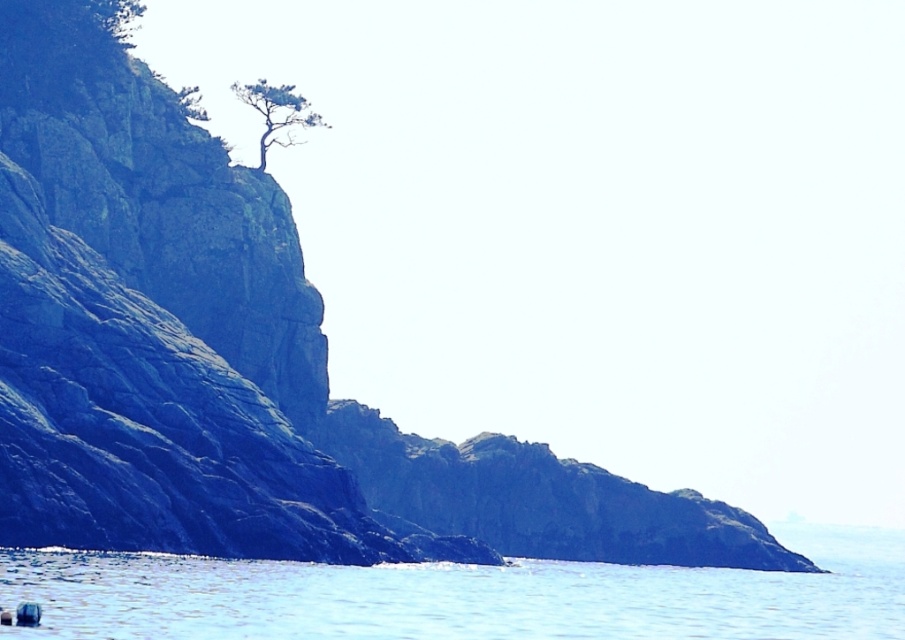
You are standing at the base of the cliff in the coastal landscape. You notice a point marked at coordinates (463, 595). According to the image, what does this point indicate?

The point at (463, 595) marks blue water at center.

Looking at this image, you are standing on the cliff and looking down at the blue water at center and the green leafy tree at upper left. Which object is directly above the other?

The green leafy tree at upper left is directly above the blue water at center because the blue water at center is positioned under it.

You are standing at the base of the cliff and want to reach the green textured tree at upper left. Which direction should you move relative to the blue water at center?

To reach the green textured tree at upper left from the base of the cliff, you should move towards the left side of the blue water at center since the tree is positioned at the upper left relative to the water.